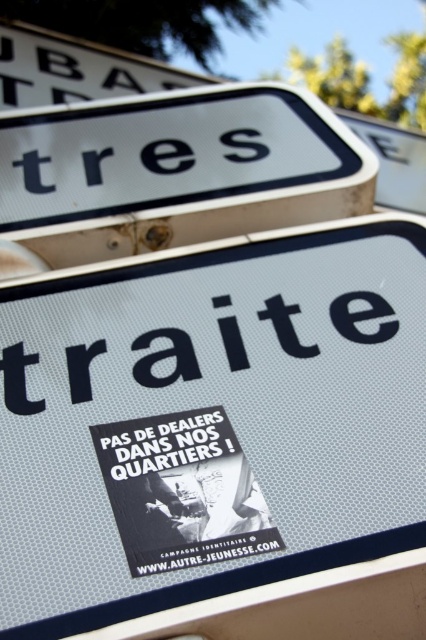
You are a street artist planning to add a new sticker to the street sign. You want to place your sticker to the right of both the black plastic text at center and the black matte text at center. Is there enough space on the sign to do this?

The black plastic text at center is to the left of black matte text at center. Therefore, placing a sticker to the right of both would require space to the right of the black matte text at center. Since the sign has a textured metal surface with existing elements, there might be enough space, but this depends on the sticker size and the sign layout beyond the described elements.

You are a street artist planning to add a new sticker to the sign. You have a sticker that is exactly the same width as the black matte text at center. Can you place your sticker to the right of the black paper sticker at center without overlapping?

The black paper sticker at center might be wider than black matte text at center. Since your sticker is the same width as the black matte text at center, there is a possibility that the black paper sticker at center is wider, which could mean there isn not enough space to place your sticker to the right without overlapping. You should check the exact width before deciding.

Based on the photo, what is the exact location of the white textured sign at center in the image?

The white textured sign at center is located at point [218,436].